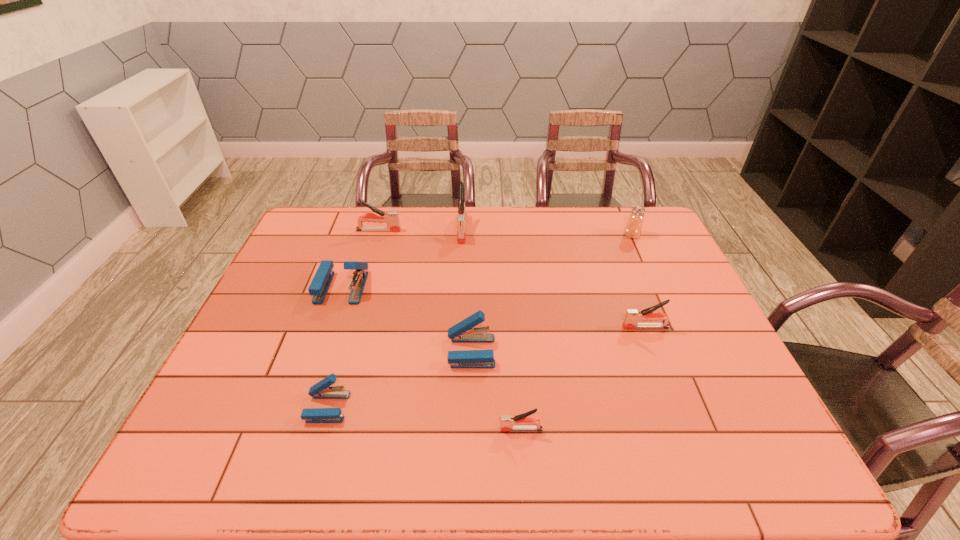
I want to click on vacant space that's between the smallest blue stapler and the rightmost blue stapler, so click(399, 379).

Where is `vacant space that's between the biggest blue stapler and the saltshaker`? vacant space that's between the biggest blue stapler and the saltshaker is located at coordinates (487, 261).

Locate an element on the screen. vacant space that's between the second nearest blue stapler and the third object from right to left is located at coordinates (496, 390).

What are the coordinates of `free spot between the fifth nearest stapler and the saltshaker` in the screenshot? It's located at (487, 261).

The image size is (960, 540). I want to click on vacant space that is in between the second nearest gray stapler and the third nearest stapler, so click(x=559, y=339).

What are the coordinates of `free space that is in between the rightmost stapler and the third nearest stapler` in the screenshot? It's located at (559, 339).

Where is `blank region between the tallest object and the second biggest gray stapler`? The height and width of the screenshot is (540, 960). blank region between the tallest object and the second biggest gray stapler is located at coordinates [x=420, y=230].

Where is `object that can be found as the third closest to the biggest gray stapler`? The image size is (960, 540). object that can be found as the third closest to the biggest gray stapler is located at coordinates (463, 332).

I want to click on object that is the third closest to the rightmost blue stapler, so click(320, 284).

Where is `stapler identified as the fifth closest to the fourth farthest stapler`? The height and width of the screenshot is (540, 960). stapler identified as the fifth closest to the fourth farthest stapler is located at coordinates (320, 284).